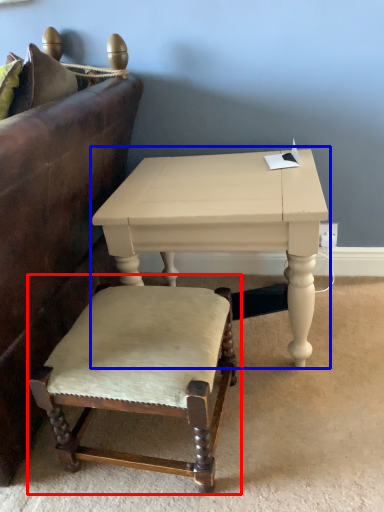
Question: Which of the following is the farthest to the observer, chair (highlighted by a red box) or table (highlighted by a blue box)?

Choices:
 (A) chair
 (B) table

Answer: (B)